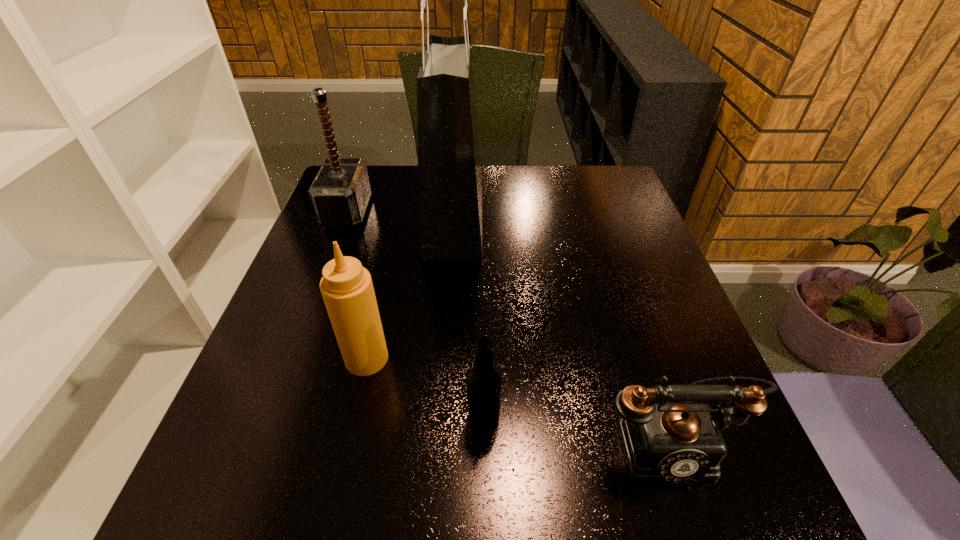
Where is `the tallest object`? This screenshot has height=540, width=960. the tallest object is located at coordinates (450, 185).

You are a GUI agent. You are given a task and a screenshot of the screen. Output one action in this format:
    pyautogui.click(x=<x>, y=<y>)
    Task: Click on the hammer
    
    Given the screenshot: What is the action you would take?
    pyautogui.click(x=340, y=192)

Locate an element on the screen. condiment is located at coordinates (346, 287).

The height and width of the screenshot is (540, 960). I want to click on the fourth object from right to left, so click(x=346, y=287).

This screenshot has height=540, width=960. In order to click on beer bottle in this screenshot , I will do `click(484, 384)`.

Find the location of `telephone`. telephone is located at coordinates (674, 442).

Where is `vacant space located 0.360m on the front with handles of the tallest object`? This screenshot has width=960, height=540. vacant space located 0.360m on the front with handles of the tallest object is located at coordinates (618, 219).

Find the location of a particular element. The height and width of the screenshot is (540, 960). vacant space located 0.200m on the right of the leftmost object is located at coordinates click(x=442, y=212).

Locate an element on the screen. This screenshot has height=540, width=960. vacant space located 0.270m on the right of the fourth object from right to left is located at coordinates (530, 359).

In order to click on free location located on the right of the beer bottle in this screenshot , I will do `click(630, 418)`.